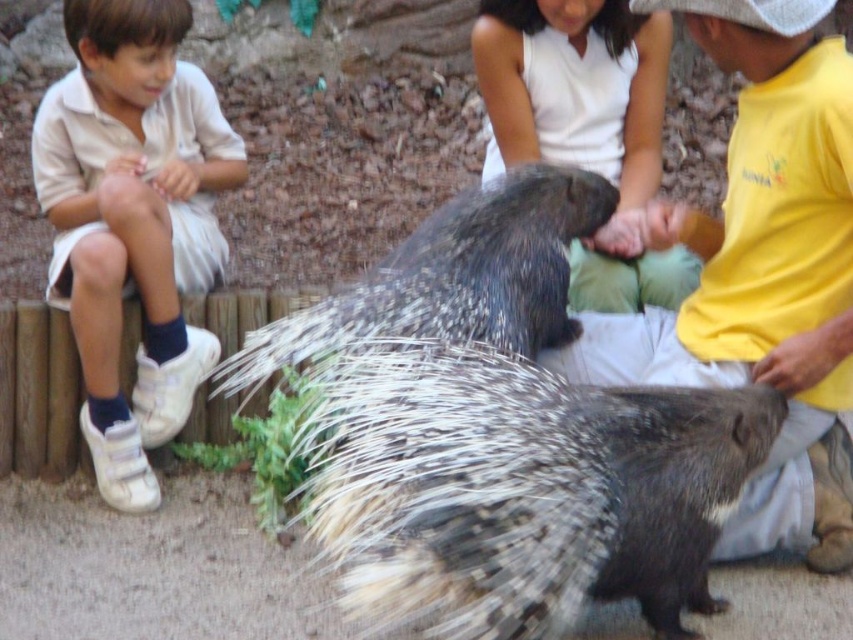
You are standing at the camera position and want to throw a small ball to the point labeled point at the coordinates (141, 36). If the ball travels in a straight line, will it pass over or under the children sitting on the wooden bench?

The point labeled point at the coordinates (141, 36) is 11.19 feet away from the camera. Since the children are sitting on a wooden bench, the ball thrown from the camera position would pass over the children as it travels to the point.

You are a zookeeper observing the porcupines and children in the exhibit. You need to ensure the children are safe. The spiky fur hedgehog at center and white cotton shirt at center are both visible from where you stand. Which object is wider in size?

The spiky fur hedgehog at center is wider than the white cotton shirt at center.